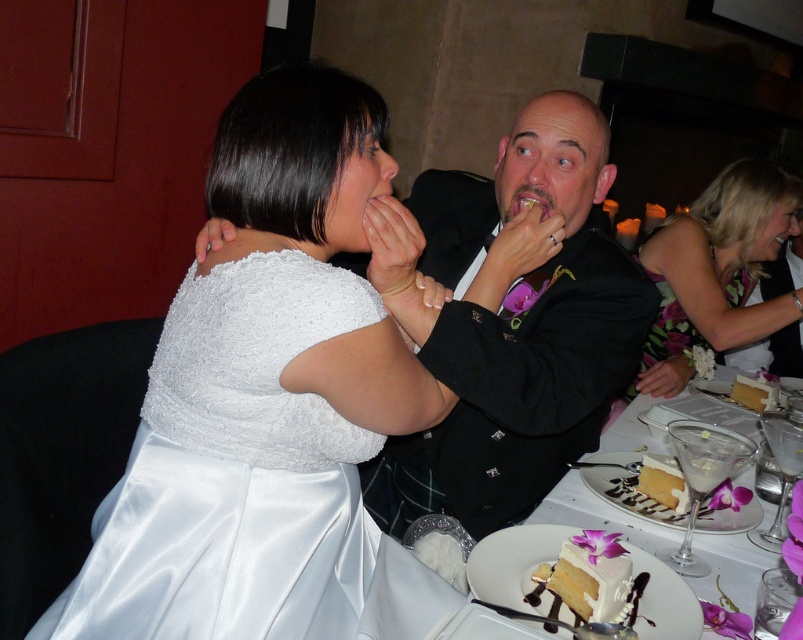
Is satin white dress at upper left below black satin suit at center?

Indeed, satin white dress at upper left is positioned under black satin suit at center.

Can you confirm if satin white dress at upper left is smaller than black satin suit at center?

Correct, satin white dress at upper left occupies less space than black satin suit at center.

Is point (404, 388) less distant than point (454, 481)?

That is True.

Locate an element on the screen. satin white dress at upper left is located at coordinates (261, 394).

Can you confirm if black satin suit at center is positioned below yellow sponge cake at lower right?

No.

The width and height of the screenshot is (803, 640). I want to click on black satin suit at center, so click(508, 321).

Who is more distant from viewer, (573,378) or (673,484)?

The point (673,484) is more distant.

The height and width of the screenshot is (640, 803). Find the location of `black satin suit at center`. black satin suit at center is located at coordinates (508, 321).

Does satin white dress at upper left have a lesser height compared to white frosted cake at lower right?

No.

Is satin white dress at upper left to the left of white frosted cake at lower right from the viewer's perspective?

Correct, you'll find satin white dress at upper left to the left of white frosted cake at lower right.

Does point (112, 605) lie in front of point (695, 529)?

That is True.

Where is `satin white dress at upper left`? satin white dress at upper left is located at coordinates (261, 394).